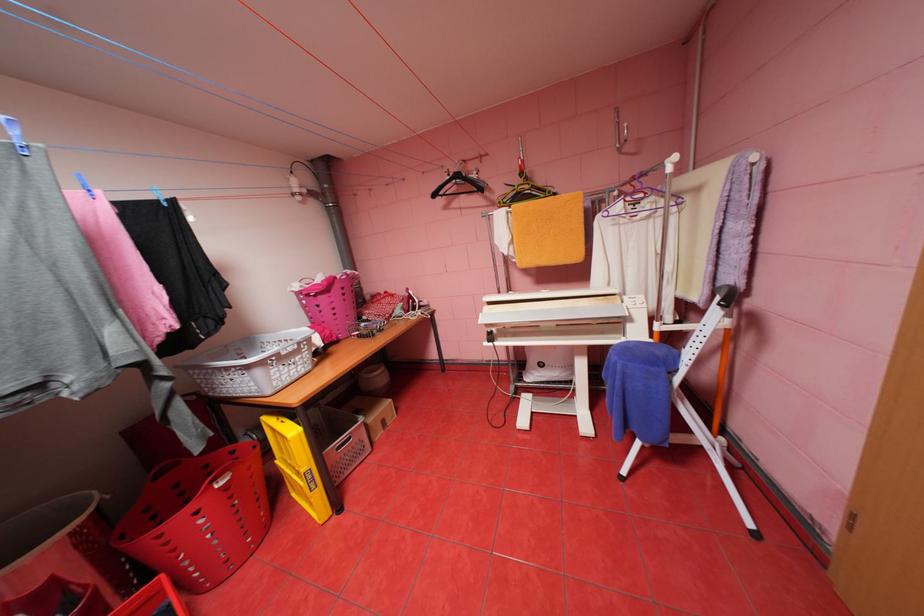
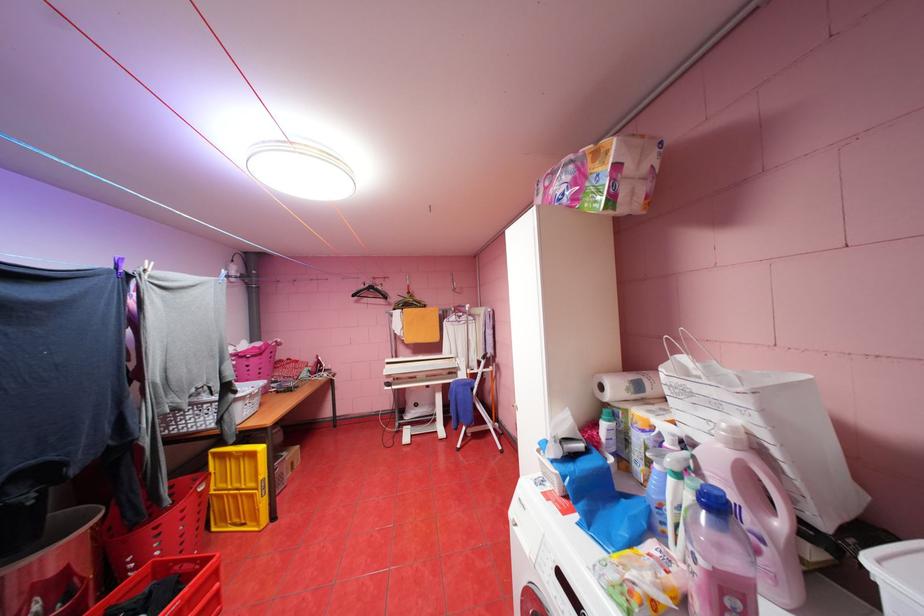
Where in the second image is the point corresponding to pixel 443 195 from the first image?

(361, 294)